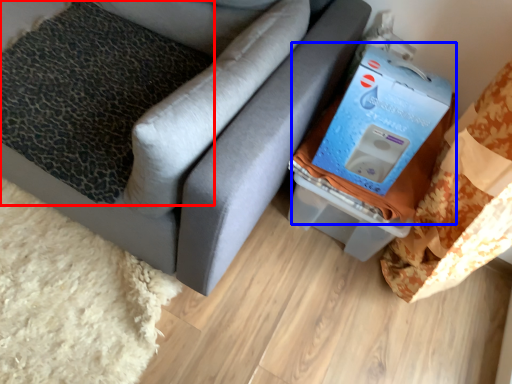
Question: Which of the following is the farthest to the observer, pillow (highlighted by a red box) or storage box (highlighted by a blue box)?

Choices:
 (A) pillow
 (B) storage box

Answer: (A)